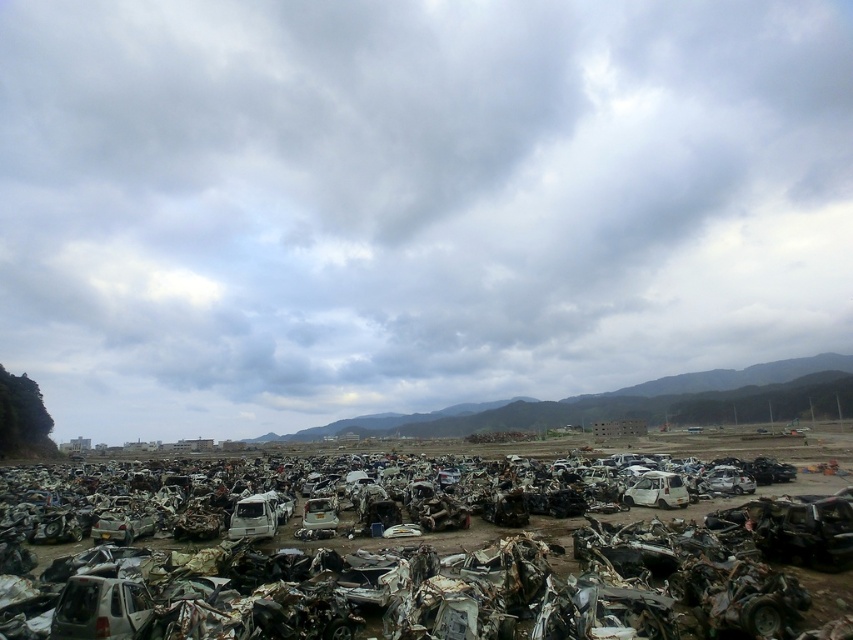
Who is more distant from viewer, (666, 609) or (129, 589)?

The point (666, 609) is behind.

Is rusty metal car at lower left shorter than white matte car at lower left?

Incorrect, rusty metal car at lower left's height does not fall short of white matte car at lower left's.

Who is more forward, (x=323, y=576) or (x=103, y=596)?

Point (x=103, y=596)

Where is `rusty metal car at lower left`? This screenshot has height=640, width=853. rusty metal car at lower left is located at coordinates 506,580.